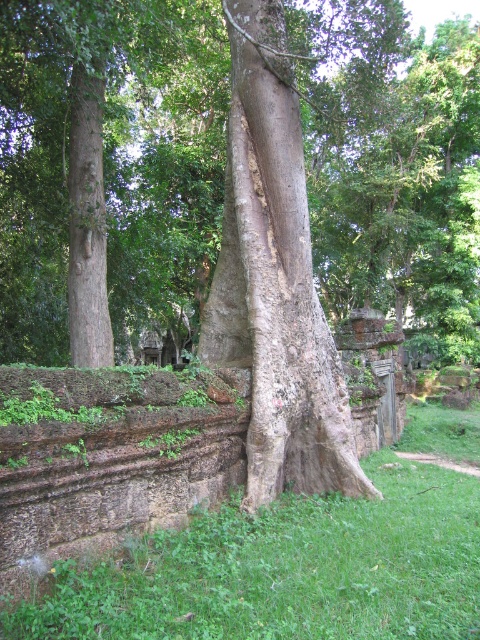
You are a gardener planning to mow the green grass at lower center and trim the smooth brown tree trunk at left. Which area requires more attention to size when planning your work?

The green grass at lower center requires more attention to size because it has a larger size compared to the smooth brown tree trunk at left.

You are an archaeologist examining the ancient ruin and notice the gray rough tree trunk at center and the smooth brown tree trunk at left. Which tree trunk is closer to you?

The gray rough tree trunk at center is closer to you since it is in front of the smooth brown tree trunk at left.

You are an archaeologist measuring tree trunks to determine their age. You have a measuring tape that can only extend 1 meter. If you want to measure the circumference of both the gray rough tree trunk at center and the smooth brown tree trunk at left, which tree trunk would require you to use the full length of your measuring tape?

The gray rough tree trunk at center might be wider than smooth brown tree trunk at left, so it would require the full length of the measuring tape if its circumference exceeds 1 meter.